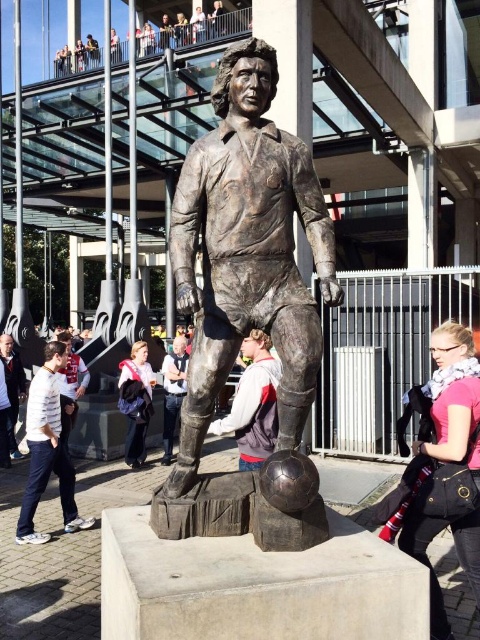
Question: Can you confirm if white cotton shirt at lower left is thinner than gray hoodie at center?

Choices:
 (A) yes
 (B) no

Answer: (B)

Question: Which object is positioned farthest from the gray hoodie at center?

Choices:
 (A) bronze statue at center
 (B) light brown leather jacket at center
 (C) light brown hair at center
 (D) bronze statue at lower left

Answer: (D)

Question: Which object is positioned farthest from the bronze statue at center?

Choices:
 (A) gray hoodie at center
 (B) light brown hair at center
 (C) bronze statue at lower left

Answer: (C)

Question: Which of the following is the closest to the observer?

Choices:
 (A) (225, 362)
 (B) (180, 397)

Answer: (A)

Question: Is white cotton shirt at lower left bigger than light brown leather jacket at center?

Choices:
 (A) no
 (B) yes

Answer: (B)

Question: Is bronze statue at center below light brown leather jacket at center?

Choices:
 (A) yes
 (B) no

Answer: (B)